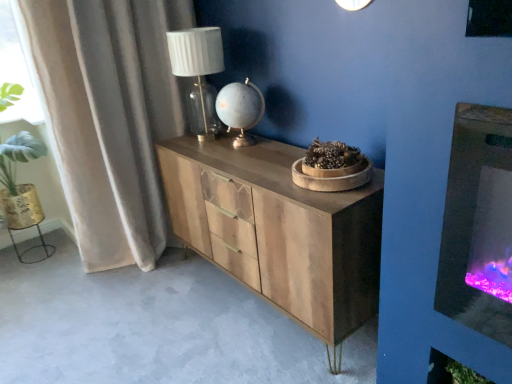
Question: Would you say wooden chest of drawers at center contains matte white glass table lamp at upper center?

Choices:
 (A) yes
 (B) no

Answer: (B)

Question: Is wooden chest of drawers at center far from matte white glass table lamp at upper center?

Choices:
 (A) yes
 (B) no

Answer: (B)

Question: Is wooden chest of drawers at center bigger than matte white glass table lamp at upper center?

Choices:
 (A) no
 (B) yes

Answer: (B)

Question: Considering the relative sizes of wooden chest of drawers at center and matte white glass table lamp at upper center in the image provided, is wooden chest of drawers at center shorter than matte white glass table lamp at upper center?

Choices:
 (A) yes
 (B) no

Answer: (B)

Question: Can you confirm if wooden chest of drawers at center is thinner than matte white glass table lamp at upper center?

Choices:
 (A) no
 (B) yes

Answer: (A)

Question: From a real-world perspective, is wooden chest of drawers at center physically above matte white glass table lamp at upper center?

Choices:
 (A) yes
 (B) no

Answer: (B)

Question: Can you confirm if velvet beige curtain at left is thinner than matte white glass table lamp at upper center?

Choices:
 (A) yes
 (B) no

Answer: (B)

Question: From the image's perspective, is velvet beige curtain at left beneath matte white glass table lamp at upper center?

Choices:
 (A) yes
 (B) no

Answer: (A)

Question: Can you confirm if velvet beige curtain at left is shorter than matte white glass table lamp at upper center?

Choices:
 (A) yes
 (B) no

Answer: (B)

Question: Does velvet beige curtain at left have a greater height compared to matte white glass table lamp at upper center?

Choices:
 (A) yes
 (B) no

Answer: (A)

Question: Is there a large distance between velvet beige curtain at left and matte white glass table lamp at upper center?

Choices:
 (A) yes
 (B) no

Answer: (B)

Question: Does velvet beige curtain at left lie in front of matte white glass table lamp at upper center?

Choices:
 (A) no
 (B) yes

Answer: (B)

Question: Would you consider matte white glass table lamp at upper center to be distant from velvet beige curtain at left?

Choices:
 (A) yes
 (B) no

Answer: (B)